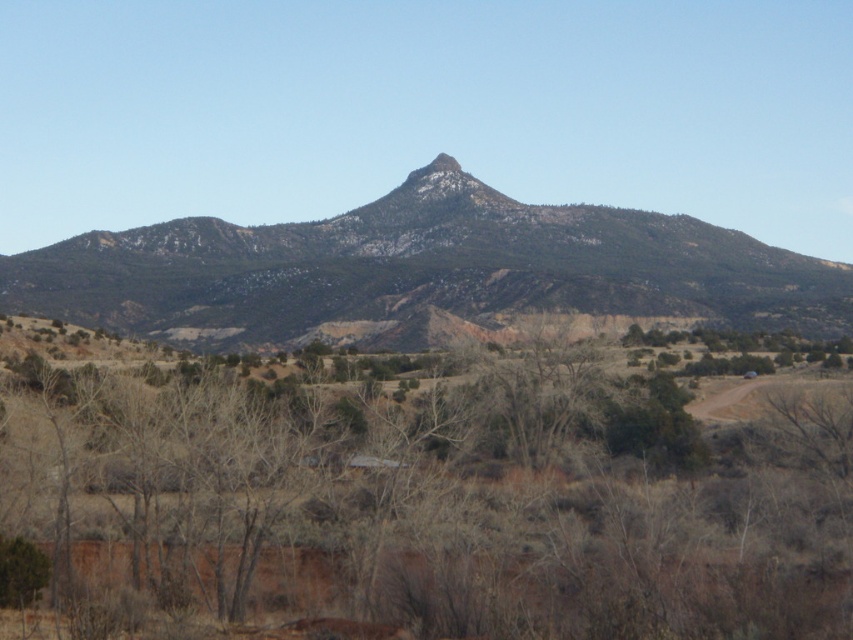
Is brown/dry wood at center positioned before rocky brown mountain at center?

Yes.

Between brown/dry wood at center and rocky brown mountain at center, which one has less height?

Standing shorter between the two is brown/dry wood at center.

What do you see at coordinates (416, 500) in the screenshot? I see `brown/dry wood at center` at bounding box center [416, 500].

Identify the location of brown/dry wood at center. (416, 500).